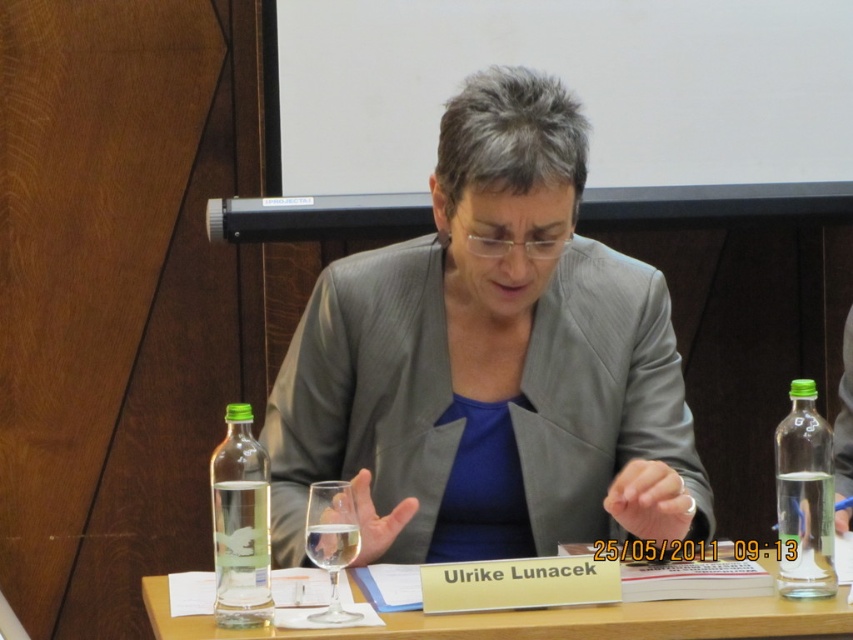
You are a GUI agent. You are given a task and a screenshot of the screen. Output one action in this format:
    pyautogui.click(x=<x>, y=<y>)
    Task: Click on the clear glass bottle at left
    The image size is (853, 640).
    Given the screenshot: What is the action you would take?
    pyautogui.click(x=241, y=524)

Can you confirm if clear glass bottle at left is positioned to the left of clear glass wine glass at center?

Correct, you'll find clear glass bottle at left to the left of clear glass wine glass at center.

Does point (227, 588) come closer to viewer compared to point (351, 547)?

That is True.

Image resolution: width=853 pixels, height=640 pixels. What are the coordinates of `clear glass bottle at left` in the screenshot? It's located at (241, 524).

Is point (746, 618) closer to camera compared to point (224, 568)?

Yes, point (746, 618) is closer to viewer.

Is wooden table at center wider than clear glass bottle at left?

Correct, the width of wooden table at center exceeds that of clear glass bottle at left.

This screenshot has height=640, width=853. What do you see at coordinates (549, 620) in the screenshot? I see `wooden table at center` at bounding box center [549, 620].

Where is `wooden table at center`? wooden table at center is located at coordinates (549, 620).

Is wooden table at center positioned in front of clear glass bottle at right?

That is True.

Between wooden table at center and clear glass bottle at right, which one is positioned lower?

Positioned lower is wooden table at center.

Identify the location of wooden table at center. (549, 620).